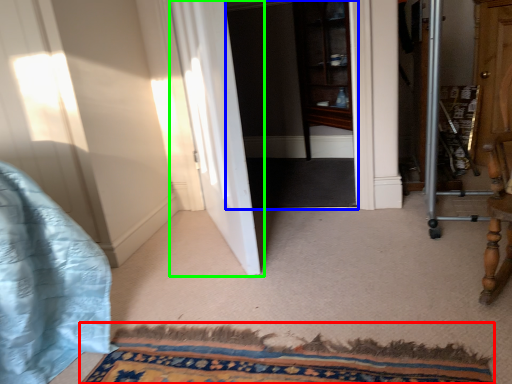
Question: Which object is the closest to the doormat (highlighted by a red box)? Choose among these: screen door (highlighted by a blue box) or door (highlighted by a green box).

Choices:
 (A) screen door
 (B) door

Answer: (B)